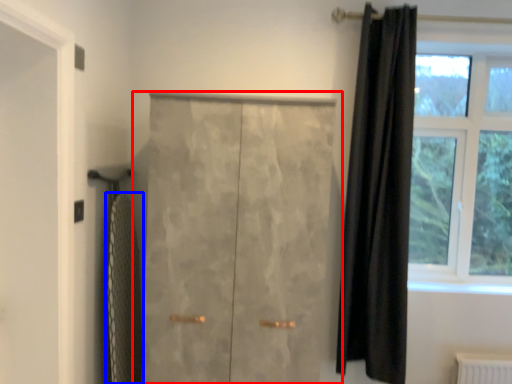
Question: Which object appears closest to the camera in this image, door (highlighted by a red box) or bath towel (highlighted by a blue box)?

Choices:
 (A) door
 (B) bath towel

Answer: (A)